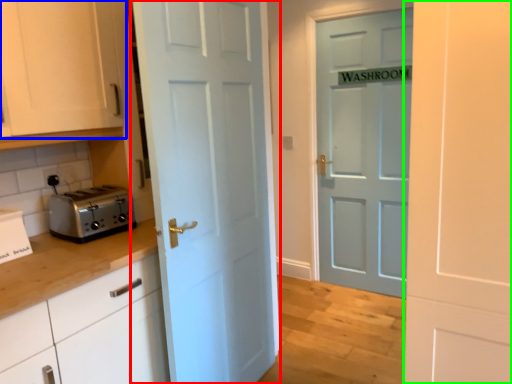
Question: Based on their relative distances, which object is farther from door (highlighted by a red box)? Choose from cabinetry (highlighted by a blue box) and door (highlighted by a green box).

Choices:
 (A) cabinetry
 (B) door

Answer: (B)